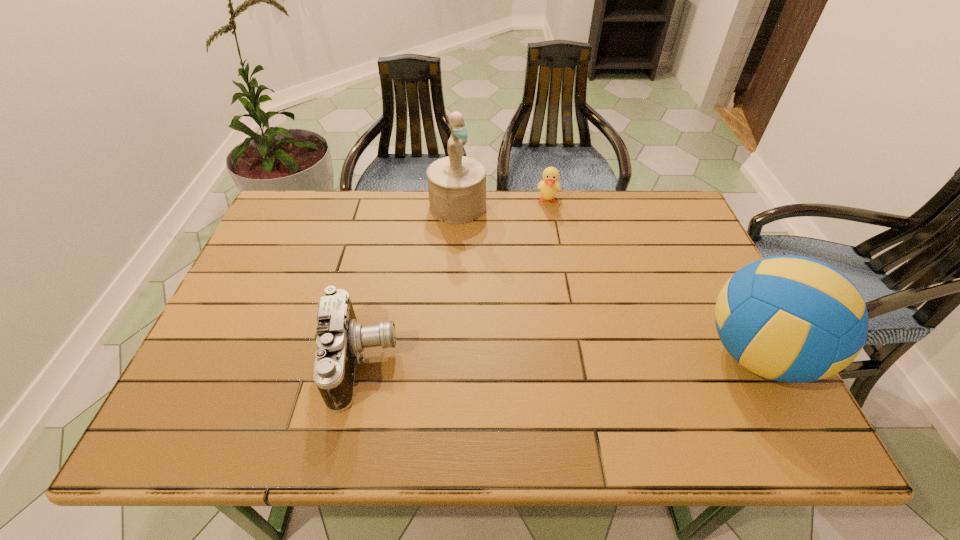
Where is `vacant space on the desktop that is between the camera and the rightmost object and is positioned at the beak of the figurine`? vacant space on the desktop that is between the camera and the rightmost object and is positioned at the beak of the figurine is located at coordinates (566, 358).

Where is `free space on the desktop that is between the camera and the volleyball and is positioned on the front-facing side of the second object from right to left`? The image size is (960, 540). free space on the desktop that is between the camera and the volleyball and is positioned on the front-facing side of the second object from right to left is located at coordinates (534, 359).